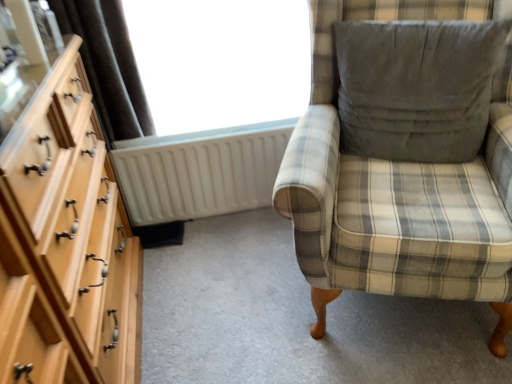
The width and height of the screenshot is (512, 384). In order to click on vacant point above white plastic radiator at center (from a real-world perspective) in this screenshot , I will do `click(218, 137)`.